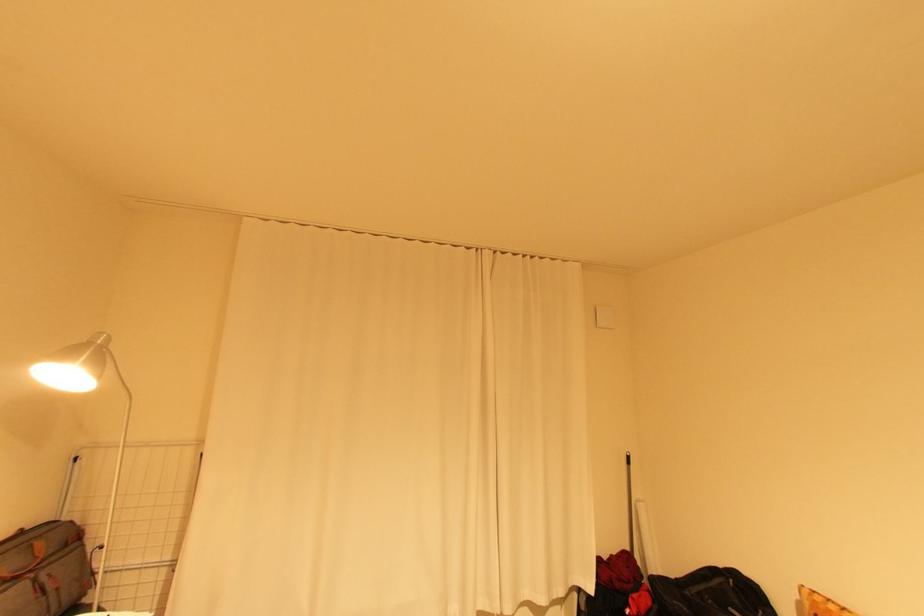
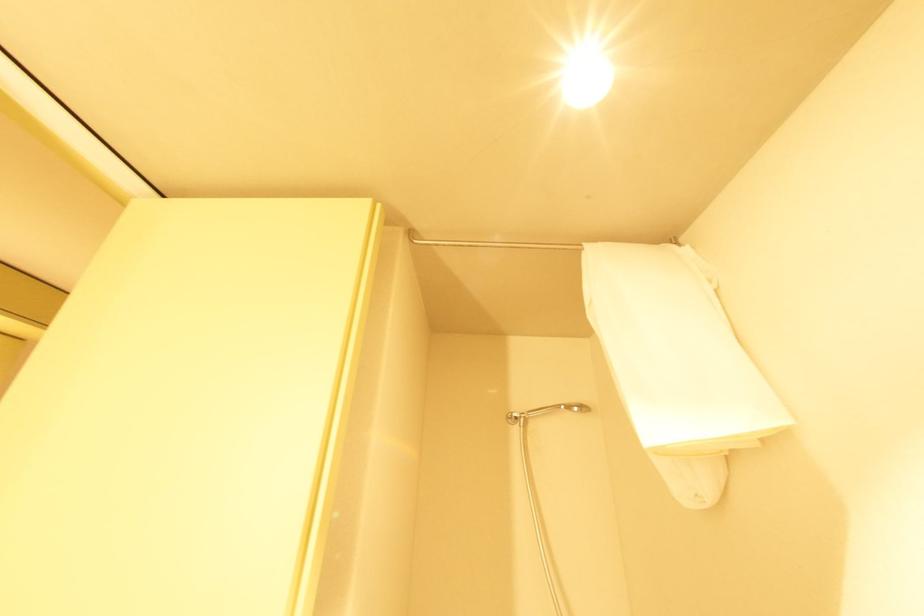
The images are taken continuously from a first-person perspective. In which direction are you moving?

The cameraman moved toward right, backward.